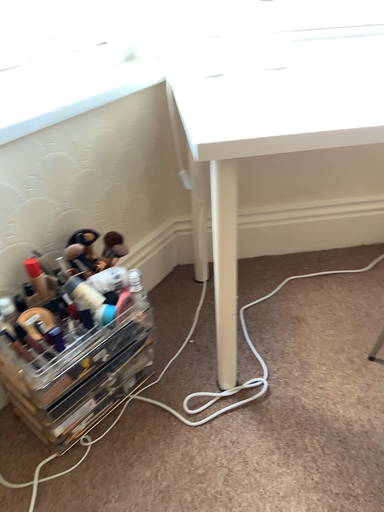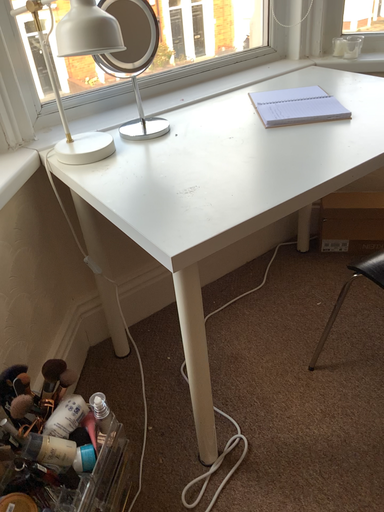
Question: How did the camera likely rotate when shooting the video?

Choices:
 (A) rotated left
 (B) rotated right

Answer: (B)